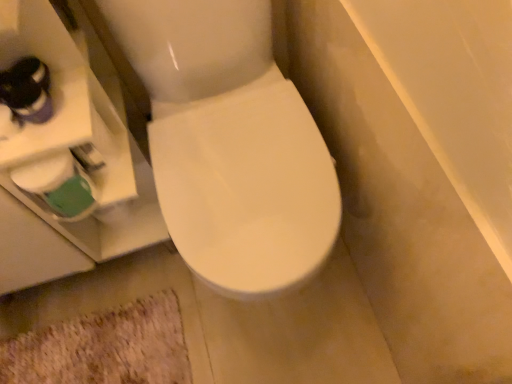
This screenshot has width=512, height=384. I want to click on free space behind beige shaggy bath mat at lower left, so click(x=98, y=282).